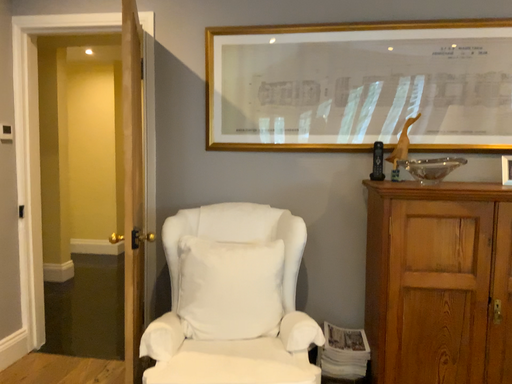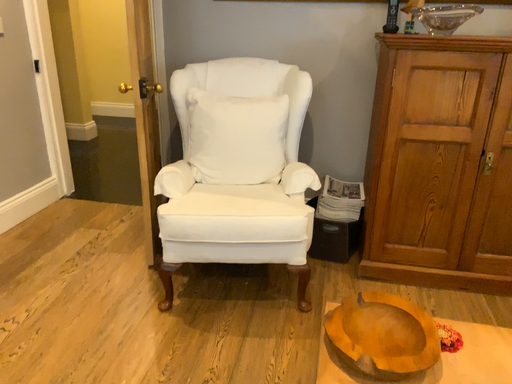
Question: How did the camera likely rotate when shooting the video?

Choices:
 (A) rotated downward
 (B) rotated upward

Answer: (A)